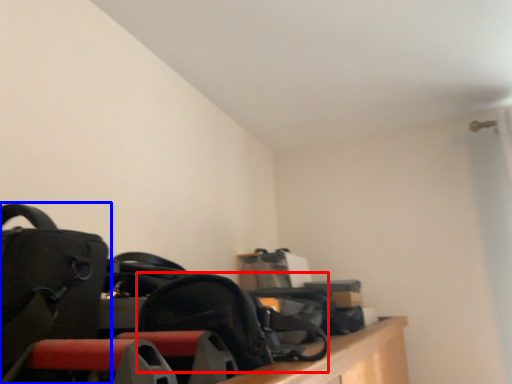
Question: Which of the following is the farthest to the observer, shoulder bag (highlighted by a red box) or luggage and bags (highlighted by a blue box)?

Choices:
 (A) shoulder bag
 (B) luggage and bags

Answer: (A)